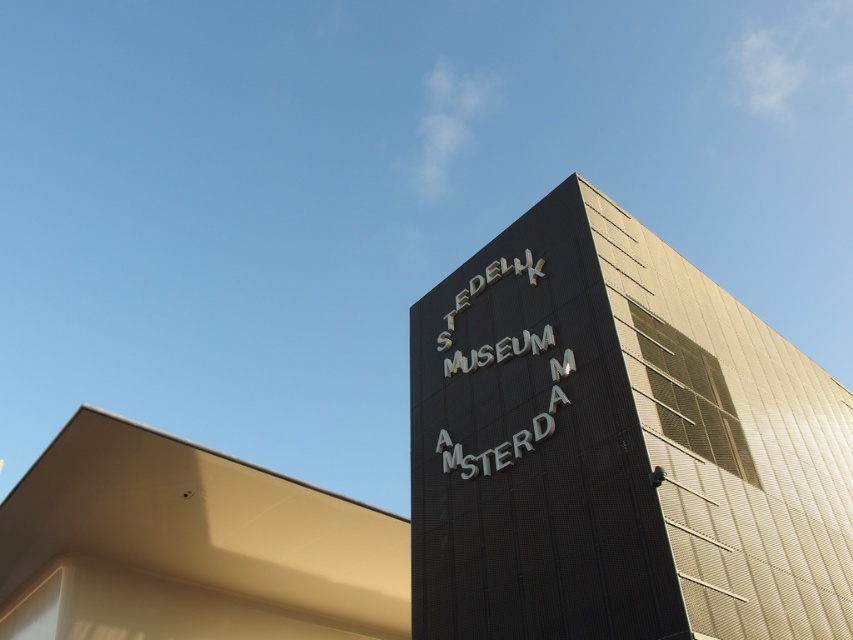
In the scene shown: Which is more to the right, black metallic sign at upper right or smooth beige roof at upper left?

Positioned to the right is black metallic sign at upper right.

Consider the image. Does black metallic sign at upper right have a greater width compared to smooth beige roof at upper left?

No, black metallic sign at upper right is not wider than smooth beige roof at upper left.

Which is in front, point (679, 275) or point (223, 612)?

Point (679, 275) is in front.

This screenshot has height=640, width=853. I want to click on black metallic sign at upper right, so click(x=618, y=445).